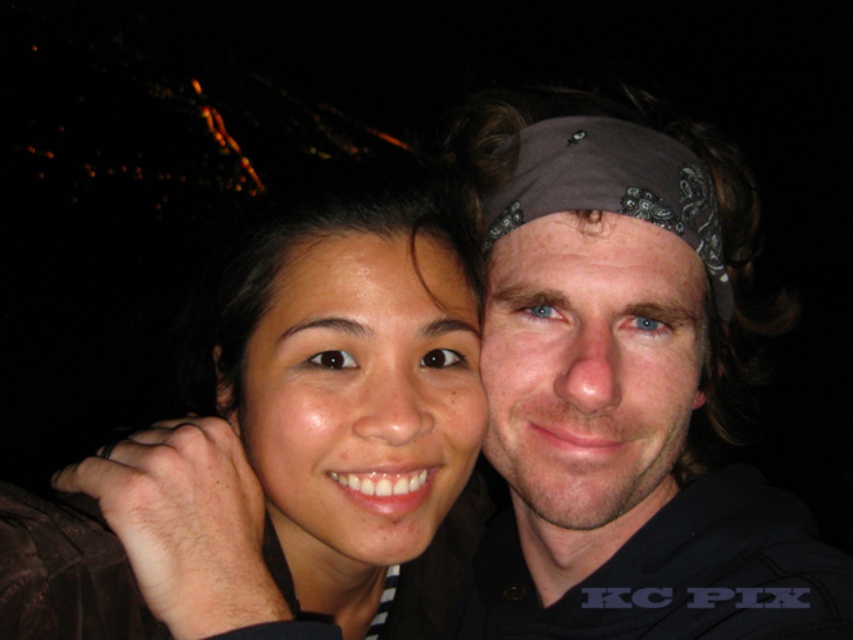
You are standing in front of the photograph described. You want to know how far the point at coordinates point (38, 557) is from you. Can you determine this distance?

The distance of point (38, 557) from viewer is 22.43 inches.

You are a photographer trying to frame a shot of the matte black hair at center and the brown bandana at center. Which object should you adjust your focus on if you want to ensure the wider one is in sharp focus?

The matte black hair at center is wider than the brown bandana at center. Therefore, you should focus on the matte black hair at center to ensure the wider object is in sharp focus.